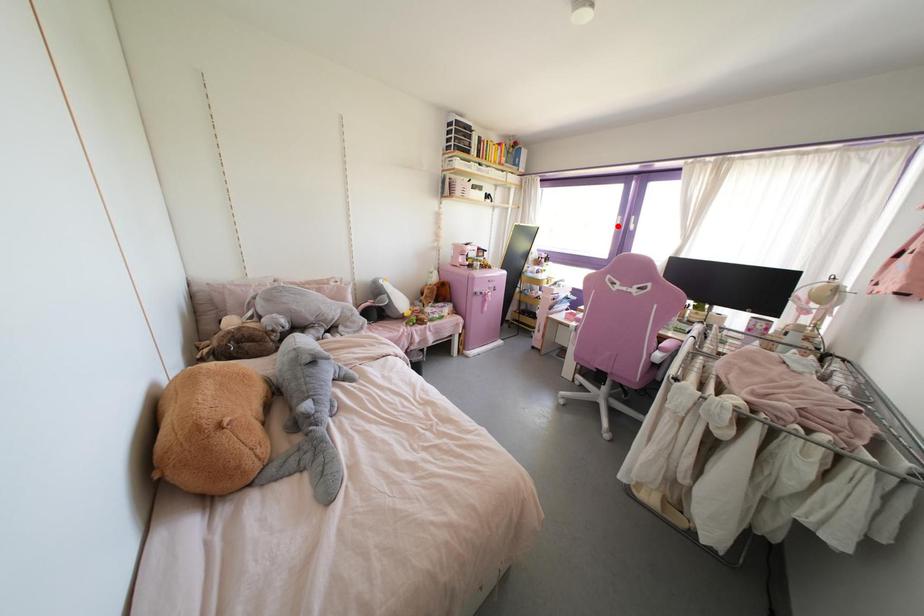
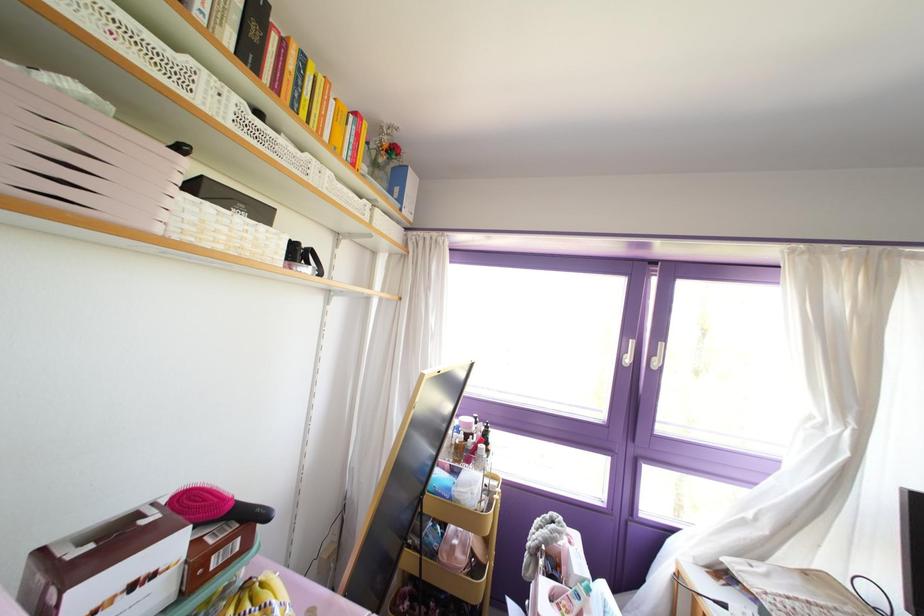
Find the pixel in the second image that matches the highlighted location in the first image.

(626, 360)